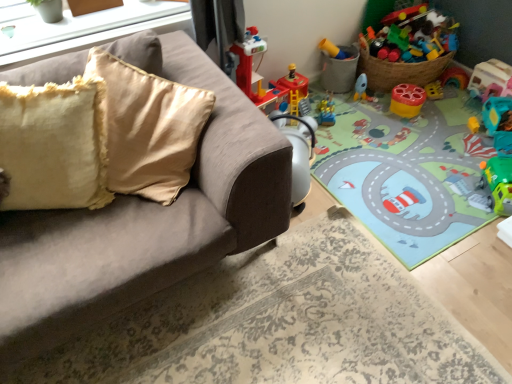
Locate an element on the screen. The height and width of the screenshot is (384, 512). unoccupied region to the right of yellow plastic cup at center-right, acting as the 4th toy starting from the right is located at coordinates (441, 108).